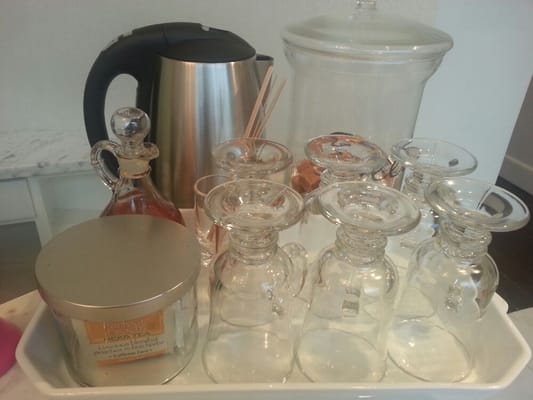
Locate an element on the screen. Image resolution: width=533 pixels, height=400 pixels. glass lid is located at coordinates (370, 32).